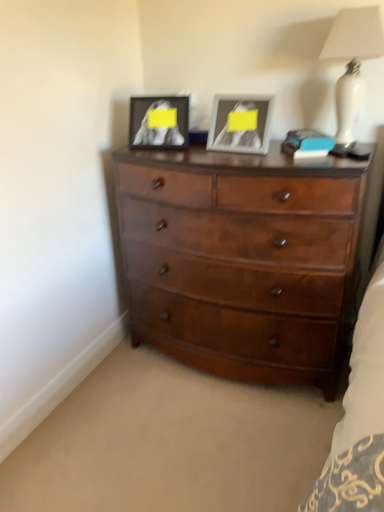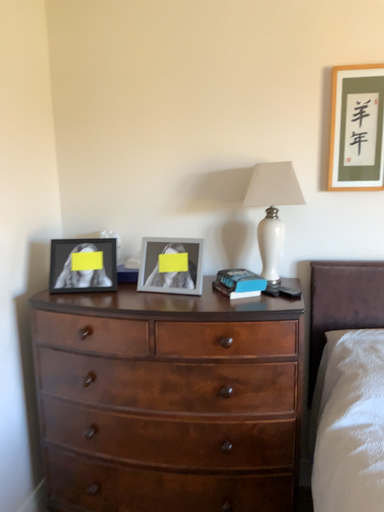
Question: How did the camera likely rotate when shooting the video?

Choices:
 (A) rotated downward
 (B) rotated upward

Answer: (B)